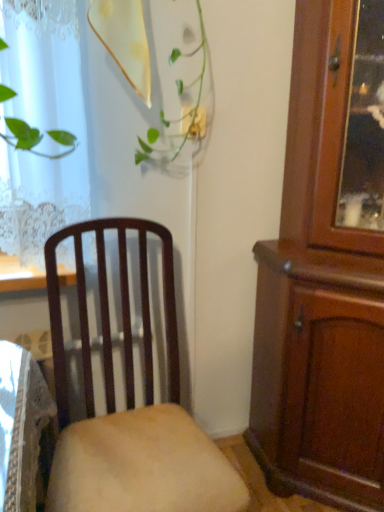
Question: From the image's perspective, is mahogany wood cabinet at right above or below matte wood chair at center?

Choices:
 (A) below
 (B) above

Answer: (B)

Question: From a real-world perspective, is mahogany wood cabinet at right positioned above or below matte wood chair at center?

Choices:
 (A) below
 (B) above

Answer: (B)

Question: Is mahogany wood cabinet at right situated inside matte wood chair at center or outside?

Choices:
 (A) outside
 (B) inside

Answer: (A)

Question: Considering their positions, is matte wood chair at center located in front of or behind mahogany wood cabinet at right?

Choices:
 (A) front
 (B) behind

Answer: (A)

Question: Is matte wood chair at center taller or shorter than mahogany wood cabinet at right?

Choices:
 (A) short
 (B) tall

Answer: (A)

Question: Based on their positions, is matte wood chair at center located to the left or right of mahogany wood cabinet at right?

Choices:
 (A) right
 (B) left

Answer: (B)

Question: From the image's perspective, is matte wood chair at center located above or below mahogany wood cabinet at right?

Choices:
 (A) above
 (B) below

Answer: (B)